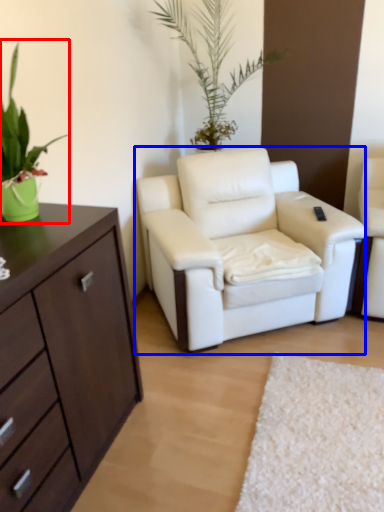
Question: Among these objects, which one is nearest to the camera, houseplant (highlighted by a red box) or chair (highlighted by a blue box)?

Choices:
 (A) houseplant
 (B) chair

Answer: (A)